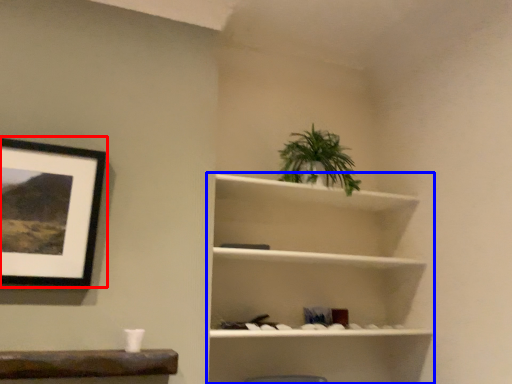
Question: Which point is closer to the camera, picture frame (highlighted by a red box) or shelf (highlighted by a blue box)?

Choices:
 (A) picture frame
 (B) shelf

Answer: (A)